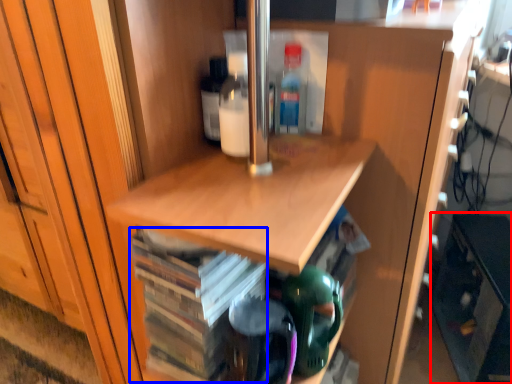
Question: Among these objects, which one is farthest to the camera, cabinetry (highlighted by a red box) or book (highlighted by a blue box)?

Choices:
 (A) cabinetry
 (B) book

Answer: (A)